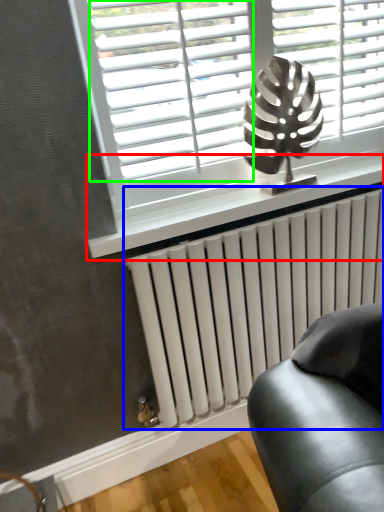
Question: Considering the real-world distances, which object is closest to window sill (highlighted by a red box)? radiator (highlighted by a blue box) or blind (highlighted by a green box).

Choices:
 (A) radiator
 (B) blind

Answer: (A)